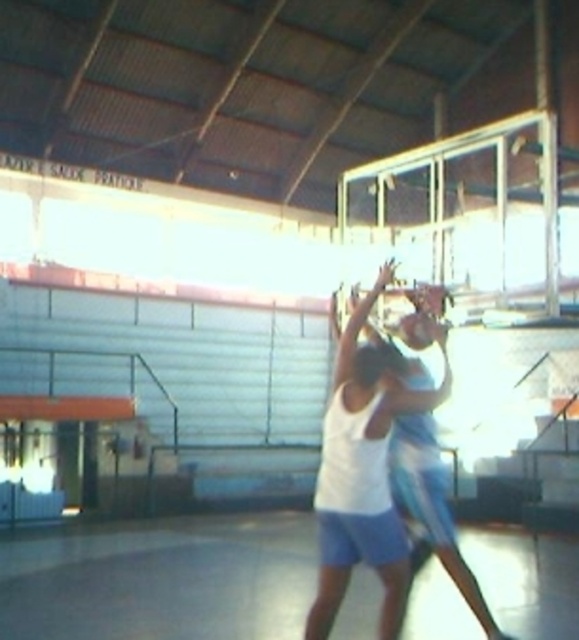
Between smooth concrete floor at center and white matte basketball at center, which one has more height?

white matte basketball at center is taller.

Does point (371, 628) come farther from viewer compared to point (379, 428)?

That is True.

The height and width of the screenshot is (640, 579). I want to click on smooth concrete floor at center, so click(x=160, y=577).